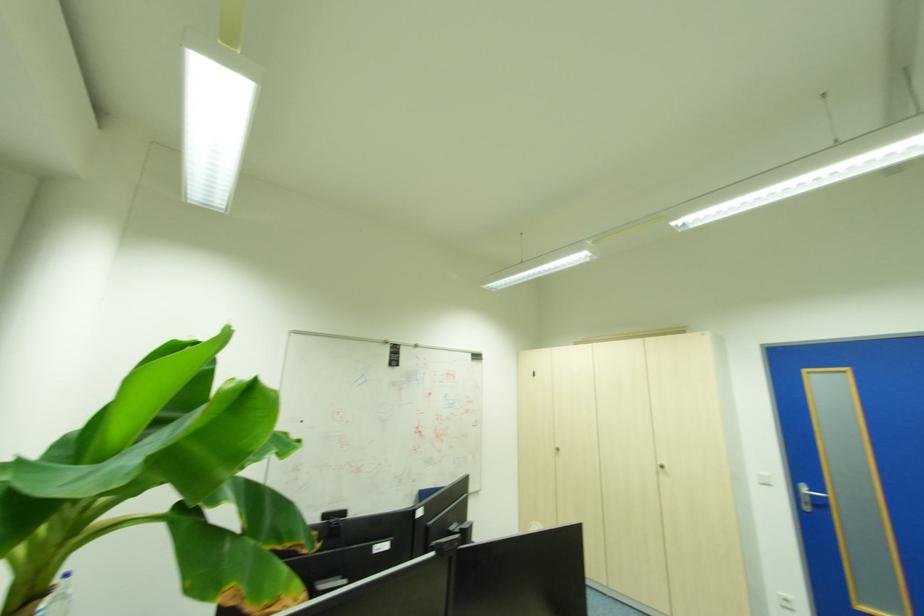
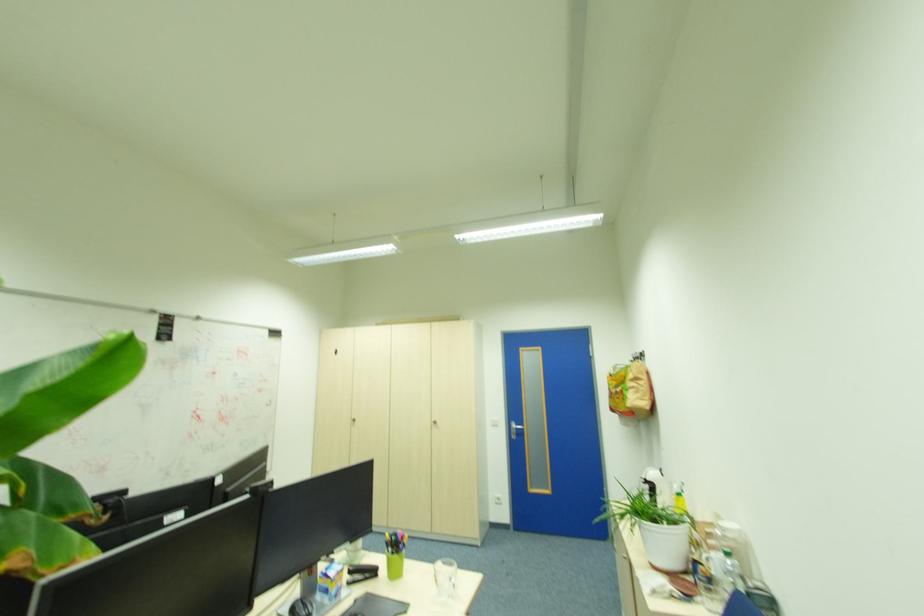
Question: The camera is either moving clockwise (left) or counter-clockwise (right) around the object. The first image is from the beginning of the video and the second image is from the end. Is the camera moving left or right when shooting the video?

Choices:
 (A) Left
 (B) Right

Answer: (A)